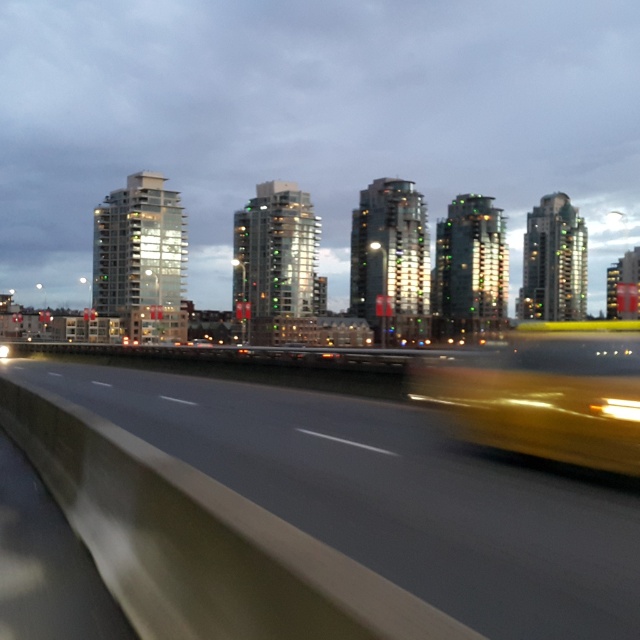
You are a pedestrian standing on the sidewalk next to the smooth asphalt highway at center. You see the yellow rubber taxi at center approaching you. In which direction is the taxi moving relative to the highway?

The yellow rubber taxi at center is moving along the smooth asphalt highway at center, which is below it. Since the highway is at the center and the taxi is also at the center, the taxi is likely moving forward along the highway in the direction of the road.

You are a delivery driver who needs to cross the smooth asphalt highway at center while avoiding the yellow rubber taxi at center. What is the minimum distance you need to maintain between your vehicle and the taxi to safely navigate around it?

The smooth asphalt highway at center and yellow rubber taxi at center are 2.40 meters apart. To safely navigate around the yellow rubber taxi at center, you should maintain at least 2.40 meters distance between your vehicle and the taxi.

You are a drone operator trying to capture a photo of the yellow rubber taxi at center from above. The smooth asphalt highway at center is in the way. Can you fly the drone over the highway to get a clear shot of the taxi?

The smooth asphalt highway at center is not as tall as the yellow rubber taxi at center, so the drone can fly over the highway to get a clear shot of the taxi.